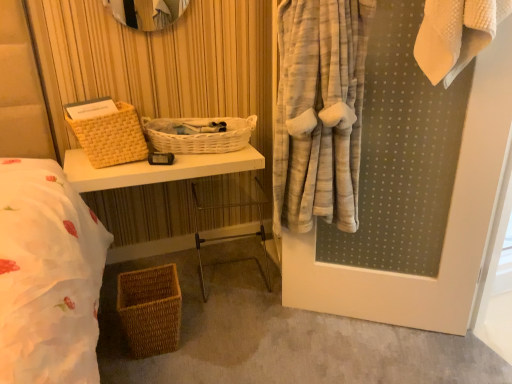
Where is `free space on the front side of woven wood table at center`? free space on the front side of woven wood table at center is located at coordinates (204, 344).